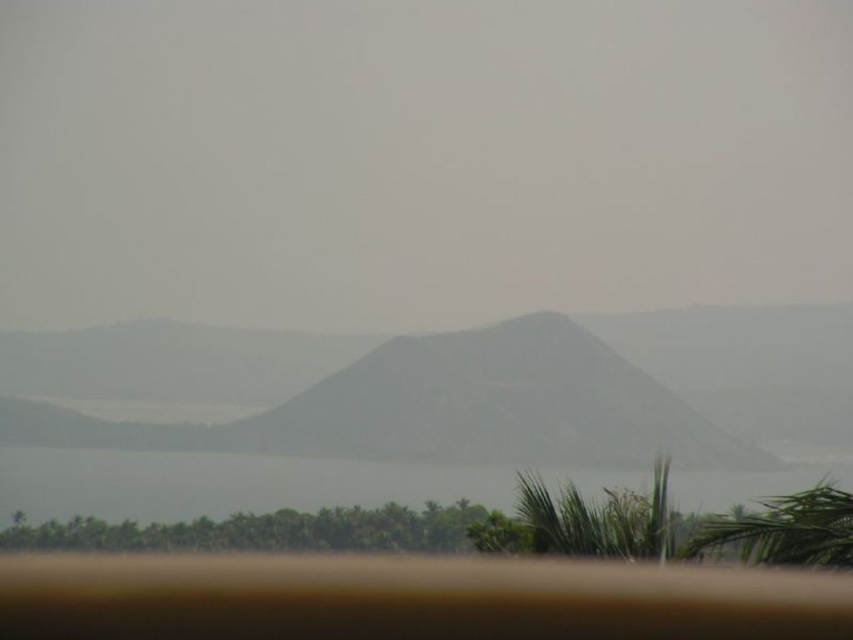
How distant is gray textured mountain at center from transparent water at lower center?

They are 19.53 meters apart.

Is point (102, 412) in front of point (78, 474)?

That is False.

This screenshot has height=640, width=853. Identify the location of gray textured mountain at center. (450, 388).

In order to click on gray textured mountain at center in this screenshot , I will do tap(450, 388).